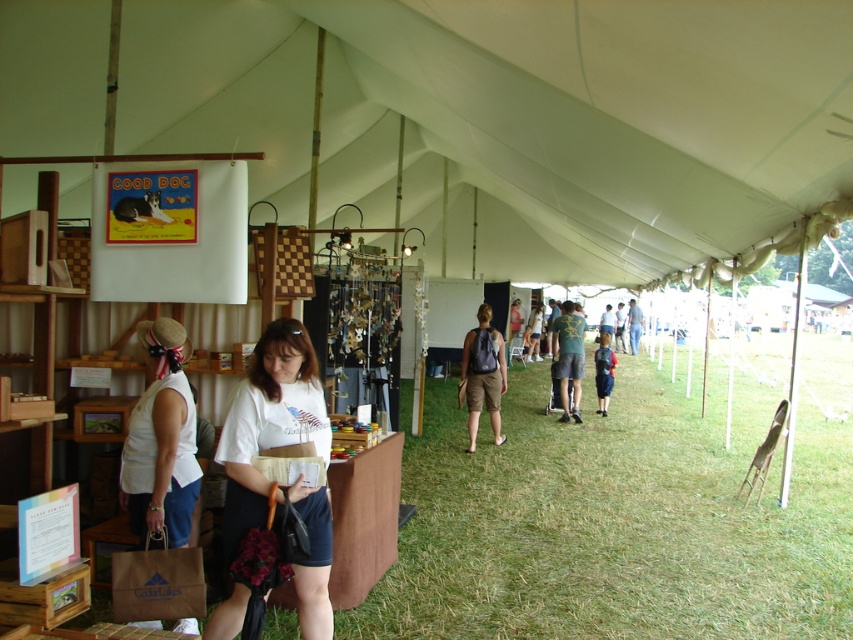
You are standing inside the tent and see the green grass at center and the blue denim shorts at center. Which object is closer to the ground?

The green grass at center is closer to the ground because it is positioned below the blue denim shorts at center.

You are setting up a booth at the event and need to place a new display stand at position point 0.6, 0.5. Is the matte brown shorts at center in the way of this new placement?

The matte brown shorts at center is located at point (x=483, y=374), which is very close to the desired placement point (x=426, y=384). Therefore, the new display stand may be obstructed by the matte brown shorts at center unless adjusted slightly.

You are organizing a clothing display in the center of the tent. You have a white cotton shirt at center and green textured shorts at center. Which item is wider?

The white cotton shirt at center is wider than the green textured shorts at center.